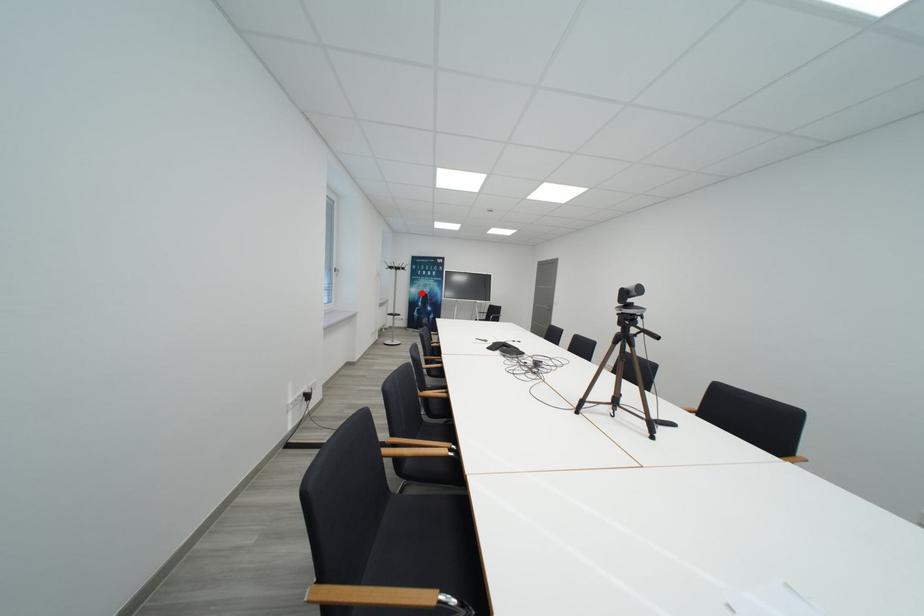
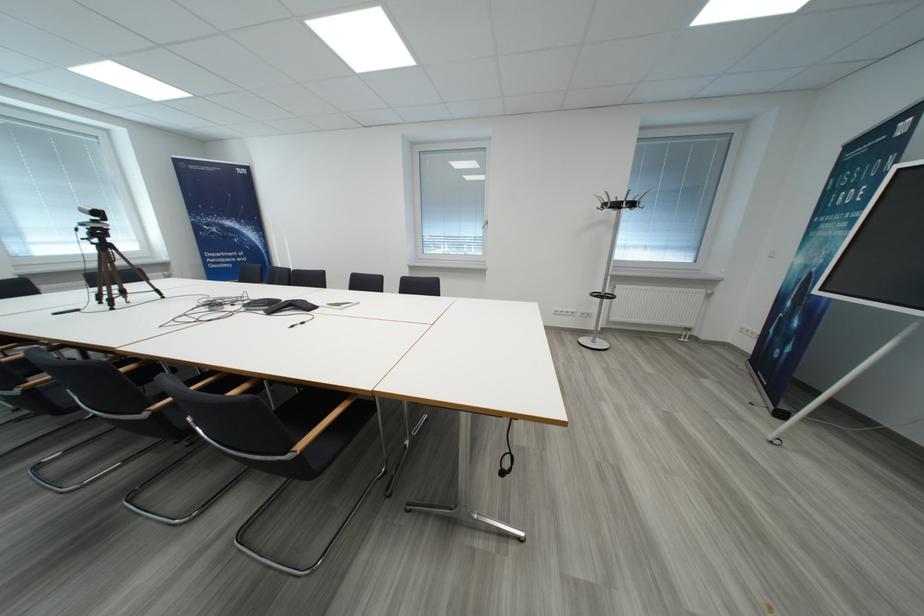
Find the pixel in the second image that matches the highlighted location in the first image.

(807, 264)